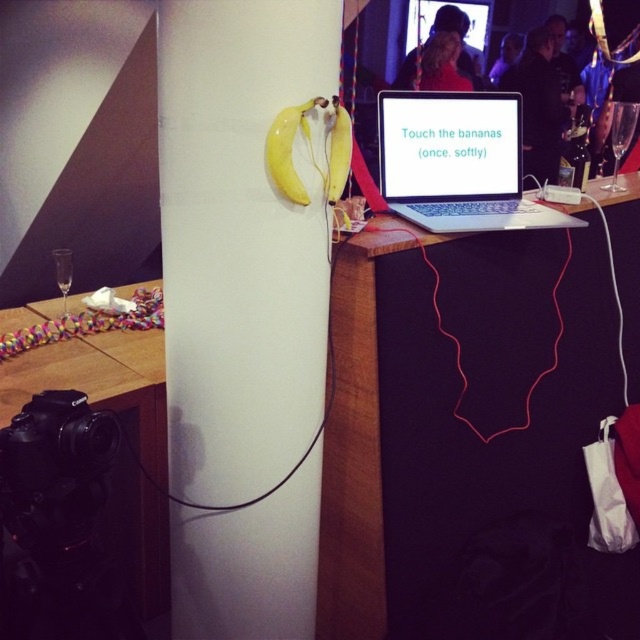
You are at an interactive art exhibit and want to place a small sculpture on the wooden table at center. The sculpture requires a surface that is lower than the white glossy pillar at center. Can you place it there?

The wooden table at center has a lesser height compared to the white glossy pillar at center, so yes, the sculpture can be placed there as it meets the requirement of being on a lower surface.

You are at an interactive art exhibit and need to place a 1.5 meter long sculpture on the wooden table at center or the white glossy pillar at center. Which surface can accommodate the sculpture based on their widths?

The wooden table at center has a greater width than the white glossy pillar at center. Therefore, the sculpture can be placed on the wooden table at center since it is wider and can accommodate the 1.5 meter long sculpture.

You are standing in the room and want to place a small gift on the wooden table at center. Based on the scene description, what are the coordinates where you should aim to place the gift?

The wooden table at center is located at coordinates point (454, 404), so you should aim for that point to place the gift.